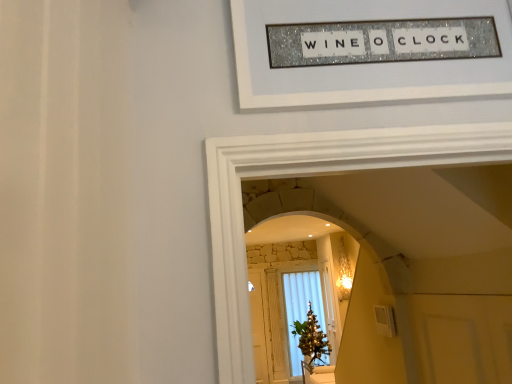
This screenshot has width=512, height=384. What do you see at coordinates (362, 64) in the screenshot?
I see `sparkly silver frame at upper center` at bounding box center [362, 64].

Locate an element on the screen. sparkly silver frame at upper center is located at coordinates (362, 64).

Locate an element on the screen. The image size is (512, 384). sparkly silver frame at upper center is located at coordinates (362, 64).